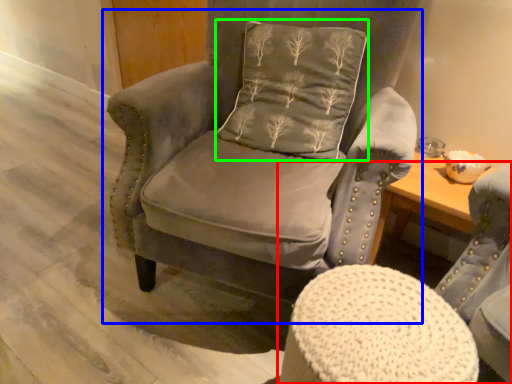
Question: Which object is the farthest from chair (highlighted by a red box)? Choose among these: chair (highlighted by a blue box) or pillow (highlighted by a green box).

Choices:
 (A) chair
 (B) pillow

Answer: (B)